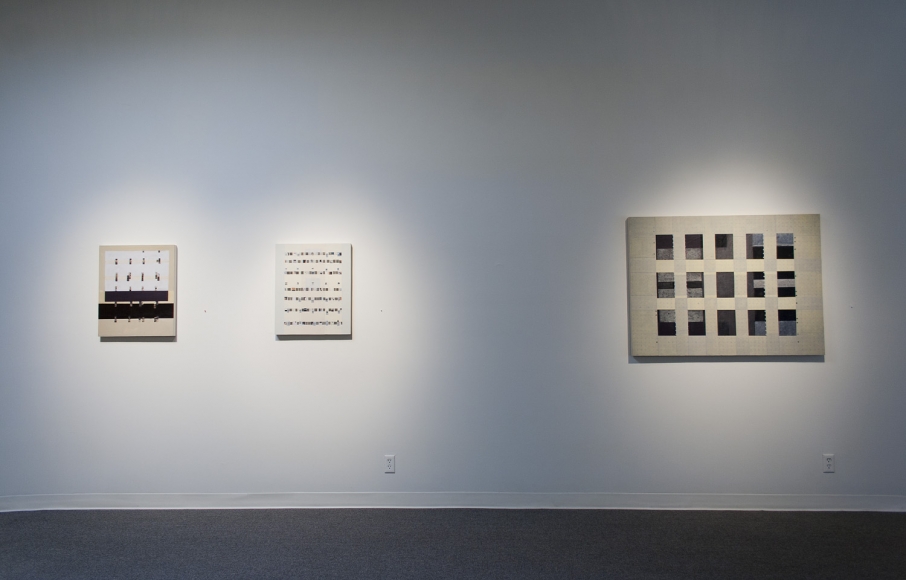
This screenshot has height=580, width=906. I want to click on power outlets, so (x=826, y=461), (x=386, y=462).